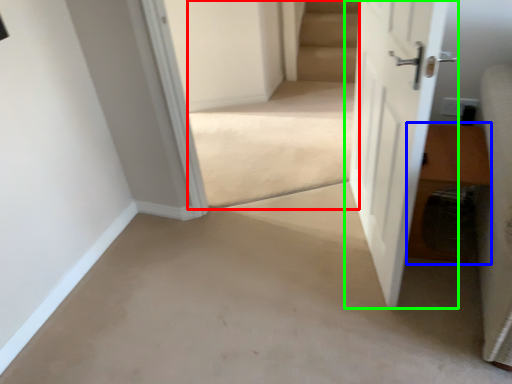
Question: Which object is the closest to the stairwell (highlighted by a red box)? Choose among these: hardwood (highlighted by a blue box) or door (highlighted by a green box).

Choices:
 (A) hardwood
 (B) door

Answer: (B)